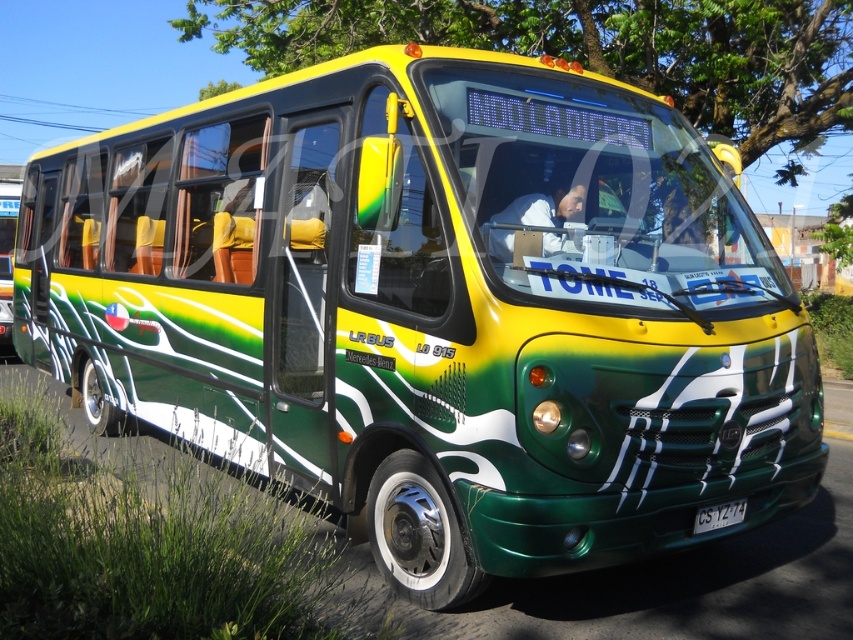
Question: Which object is closer to the camera taking this photo?

Choices:
 (A) white fabric at center
 (B) white plastic license plate at center

Answer: (A)

Question: Is the position of white fabric at center less distant than that of white plastic license plate at center?

Choices:
 (A) yes
 (B) no

Answer: (A)

Question: Does white fabric at center have a lesser width compared to white plastic license plate at center?

Choices:
 (A) yes
 (B) no

Answer: (B)

Question: Which of the following is the farthest from the observer?

Choices:
 (A) white plastic license plate at center
 (B) white fabric at center

Answer: (A)

Question: Can you confirm if white fabric at center is bigger than white plastic license plate at center?

Choices:
 (A) no
 (B) yes

Answer: (B)